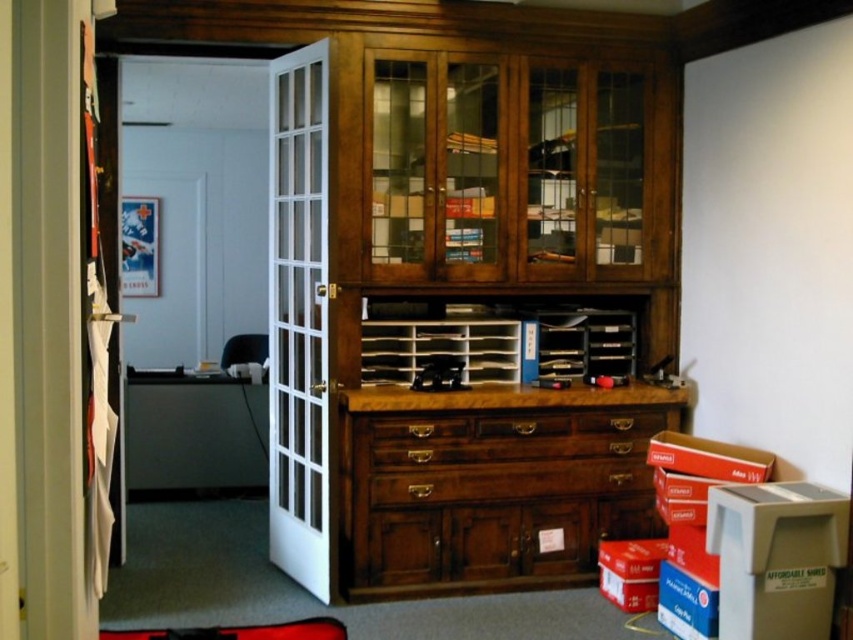
You are an office worker who needs to move a 24 inch wide box from the white glass door at left to the wooden drawer at center. Can you slide the box horizontally between them without tilting it?

The distance between the white glass door at left and wooden drawer at center is 26.29 inches. Since the box is 24 inches wide, it can fit horizontally as the space is wider than the box.

You are an office worker who needs to move a 1.2 meter tall box into the office. The box is too tall to fit through any doorway. You see the white glass door at left and the brown wood drawer at center. Which object is taller so that the box might not fit through it?

The white glass door at left is taller than the brown wood drawer at center. Since the box is 1.2 meters tall and the door is taller than the drawer, but we don not have exact measurements, it is uncertain if the door is tall enough. However, since the door is the only potential pathway, you should check the door height first.